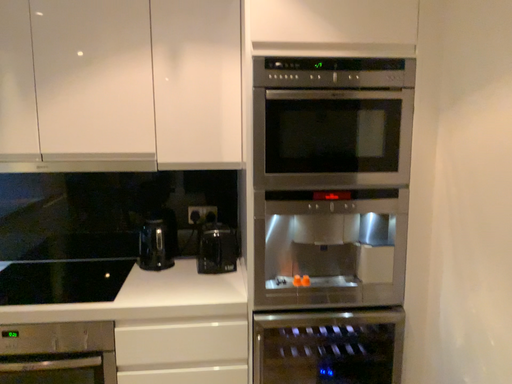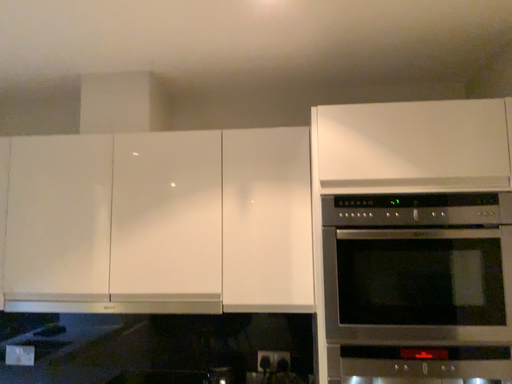
Question: How did the camera likely rotate when shooting the video?

Choices:
 (A) rotated left
 (B) rotated right

Answer: (A)